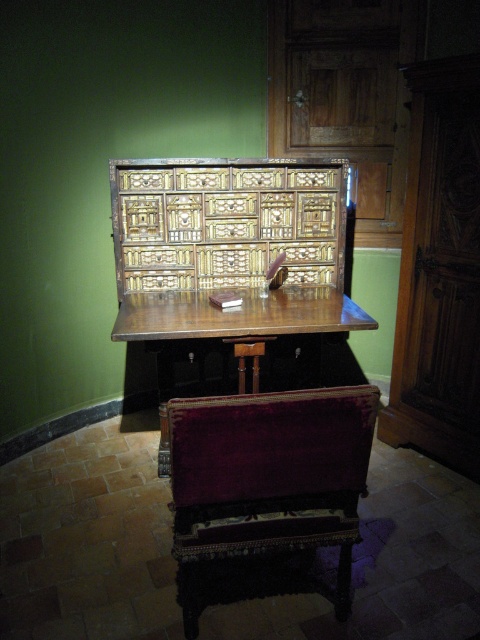
Question: Which of the following is the farthest from the observer?

Choices:
 (A) wooden stool at center
 (B) velvet burgundy chair at lower center

Answer: (A)

Question: Does velvet burgundy chair at lower center lie in front of wooden stool at center?

Choices:
 (A) no
 (B) yes

Answer: (B)

Question: Can you confirm if polished wood table at center is positioned to the left of wooden stool at center?

Choices:
 (A) yes
 (B) no

Answer: (A)

Question: Which of these objects is positioned farthest from the wooden stool at center?

Choices:
 (A) polished wood table at center
 (B) velvet burgundy chair at lower center

Answer: (B)

Question: Can you confirm if polished wood table at center is positioned to the right of wooden stool at center?

Choices:
 (A) yes
 (B) no

Answer: (B)

Question: Based on their relative distances, which object is nearer to the velvet burgundy chair at lower center?

Choices:
 (A) wooden stool at center
 (B) polished wood table at center

Answer: (A)